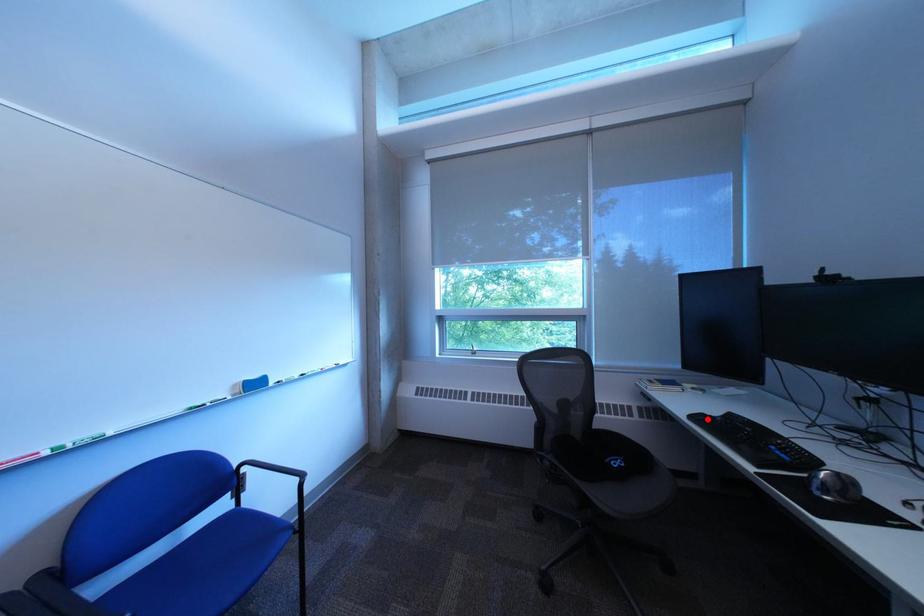
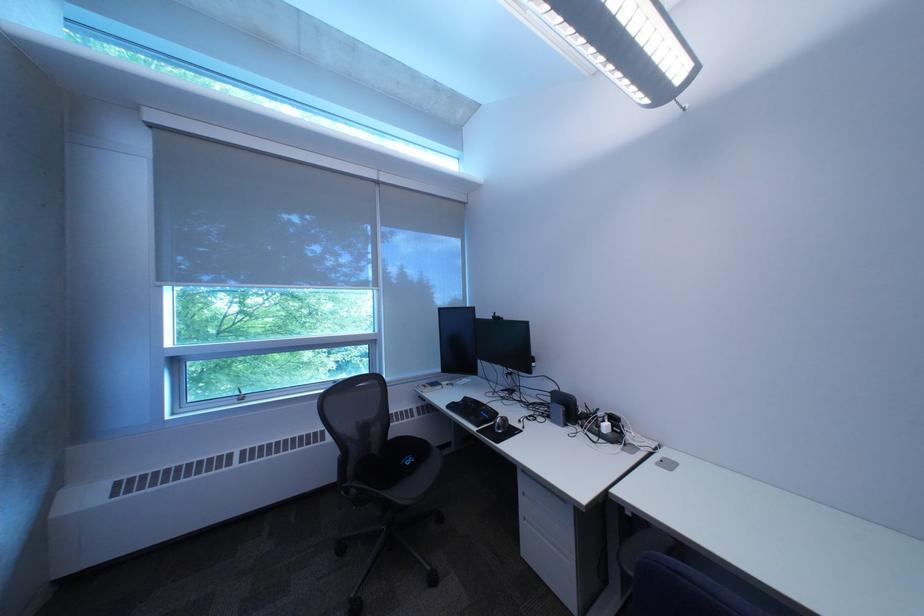
Find the pixel in the second image that matches the highlighted location in the first image.

(464, 408)